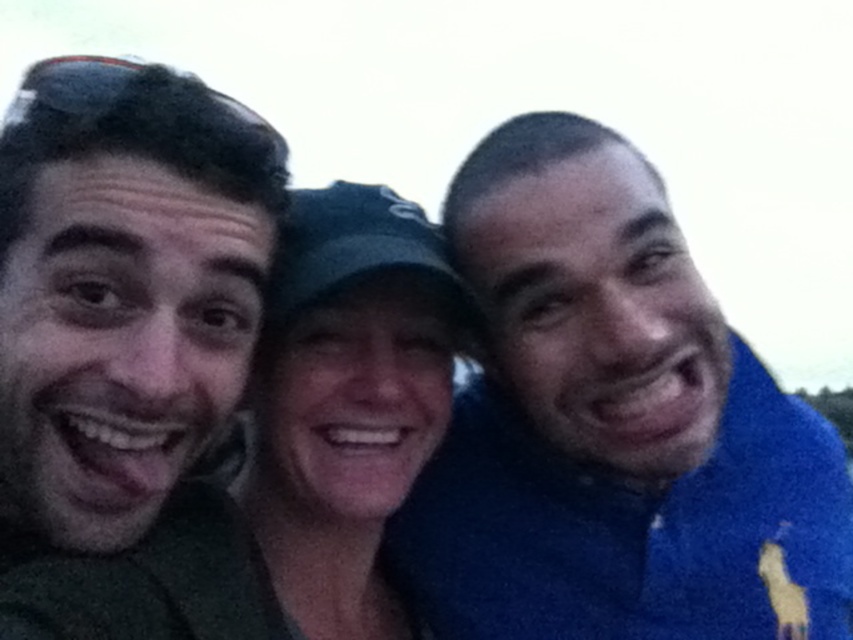
Consider the image. You are trying to take a group photo with two friends. You have a camera with a 1.5 meter depth of field. The two friends are wearing the blue fleece jacket at right and the matte green shirt at left. Based on their positions, will both friends be in focus in the photo?

The matte green shirt at left is behind the blue fleece jacket at right, so the distance between them is less than 1.5 meters. Therefore, both friends will be in focus in the photo.

You are a photographer trying to adjust the lighting for a group photo. You notice a point at coordinates (613, 426) in the image. Based on the scene description, which object is this point located on?

The point at coordinates (613, 426) is located on the blue fleece jacket at right.